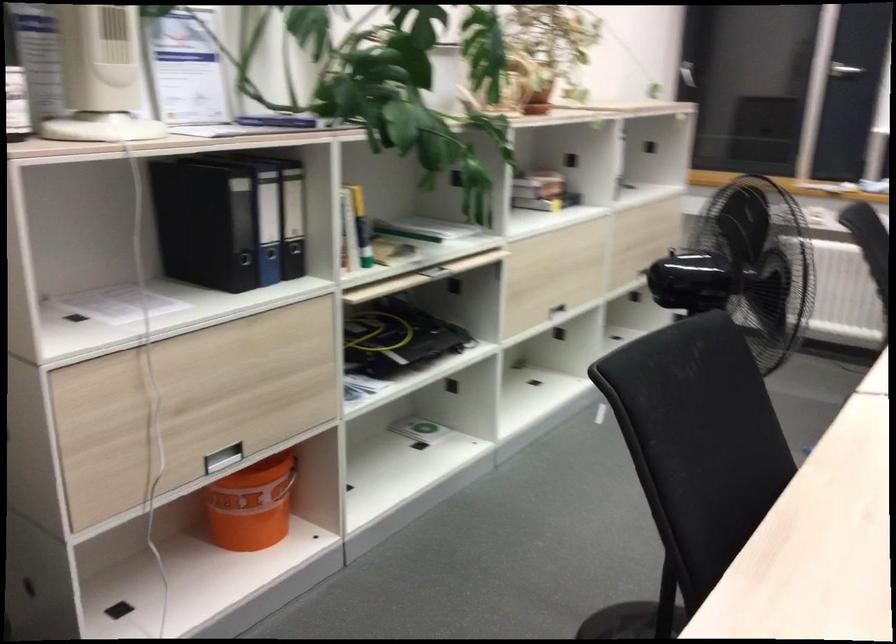
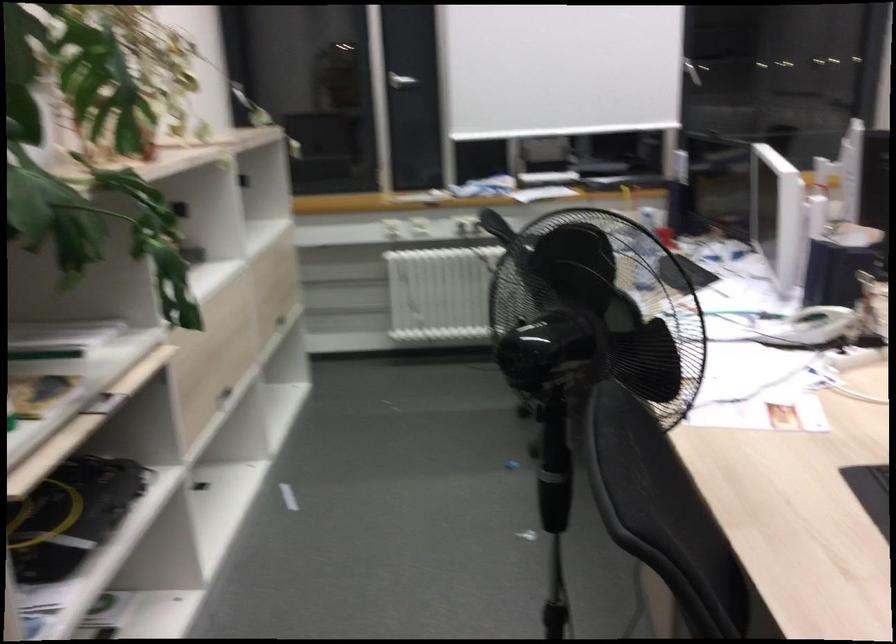
Question: Based on the continuous images, in which direction is the camera rotating? Reply with the corresponding letter.

Choices:
 (A) Left
 (B) Right
 (C) Up
 (D) Down

Answer: (B)